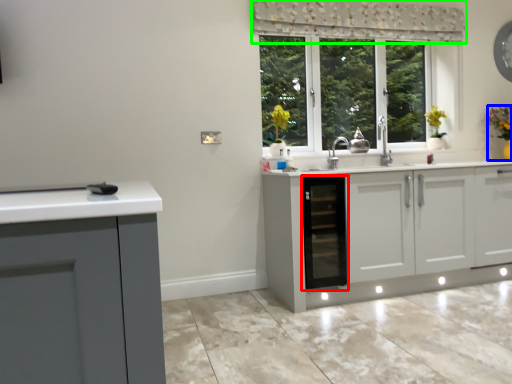
Question: Which object is positioned closest to dish washer (highlighted by a red box)? Select from houseplant (highlighted by a blue box) and curtain (highlighted by a green box).

Choices:
 (A) houseplant
 (B) curtain

Answer: (B)